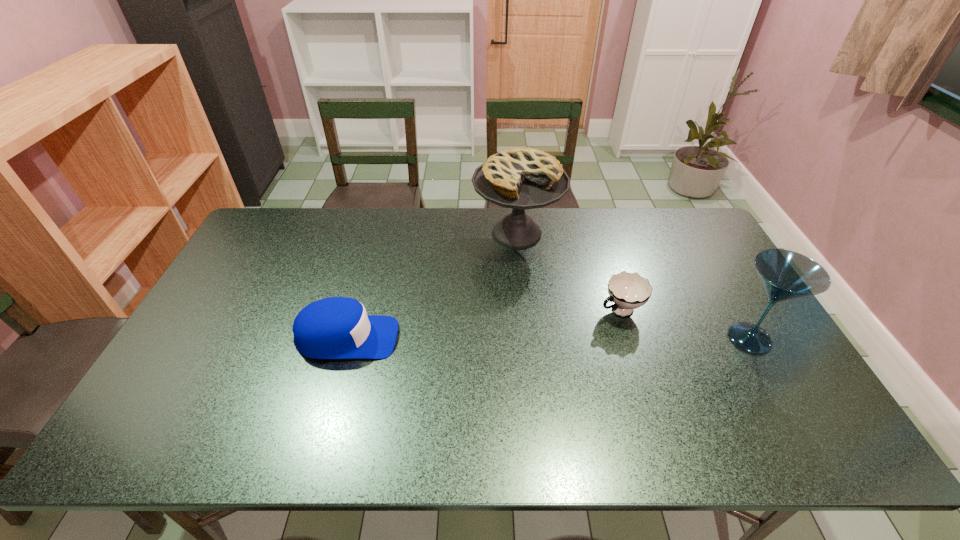
The width and height of the screenshot is (960, 540). What are the coordinates of `free space at the near left corner` in the screenshot? It's located at (208, 397).

The width and height of the screenshot is (960, 540). Find the location of `vacant space at the far right corner of the desktop`. vacant space at the far right corner of the desktop is located at coordinates (694, 219).

You are a GUI agent. You are given a task and a screenshot of the screen. Output one action in this format:
    pyautogui.click(x=<x>, y=<y>)
    Task: Click on the free space between the cup and the leftmost object
    This screenshot has width=960, height=540.
    Given the screenshot: What is the action you would take?
    pyautogui.click(x=483, y=324)

The width and height of the screenshot is (960, 540). What are the coordinates of `vacant area between the baseball cap and the cup` in the screenshot? It's located at (483, 324).

I want to click on unoccupied position between the third object from left to right and the leftmost object, so click(x=483, y=324).

Locate an element on the screen. This screenshot has width=960, height=540. empty space between the farthest object and the cup is located at coordinates (568, 272).

At what (x,y) coordinates should I click in order to perform the action: click on free space between the cup and the rightmost object. Please return your answer as a coordinate pair (x, y). This screenshot has width=960, height=540. Looking at the image, I should click on (684, 324).

In order to click on vacant area that lies between the martini and the third object from left to right in this screenshot , I will do `click(684, 324)`.

Identify the location of blank region between the leftmost object and the pie. This screenshot has width=960, height=540. (432, 286).

Where is `free point between the cup and the leftmost object`? The width and height of the screenshot is (960, 540). free point between the cup and the leftmost object is located at coordinates (483, 324).